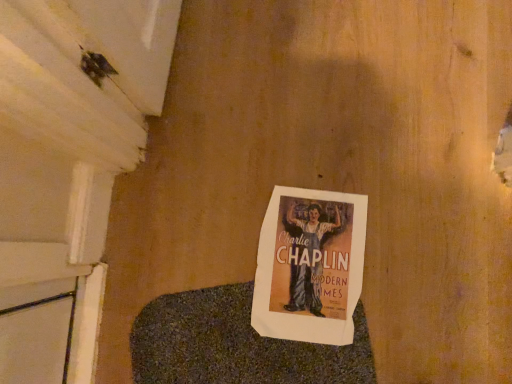
Question: Is matte paper poster at center to the left or to the right of blue textured blanket at center in the image?

Choices:
 (A) right
 (B) left

Answer: (A)

Question: Is matte paper poster at center wider or thinner than blue textured blanket at center?

Choices:
 (A) thin
 (B) wide

Answer: (A)

Question: From a real-world perspective, relative to blue textured blanket at center, is matte paper poster at center vertically above or below?

Choices:
 (A) below
 (B) above

Answer: (A)

Question: From a real-world perspective, is blue textured blanket at center positioned above or below matte paper poster at center?

Choices:
 (A) above
 (B) below

Answer: (A)

Question: From the image's perspective, is blue textured blanket at center above or below matte paper poster at center?

Choices:
 (A) above
 (B) below

Answer: (B)

Question: Is blue textured blanket at center situated inside matte paper poster at center or outside?

Choices:
 (A) inside
 (B) outside

Answer: (B)

Question: Considering the positions of blue textured blanket at center and matte paper poster at center in the image, is blue textured blanket at center taller or shorter than matte paper poster at center?

Choices:
 (A) tall
 (B) short

Answer: (A)